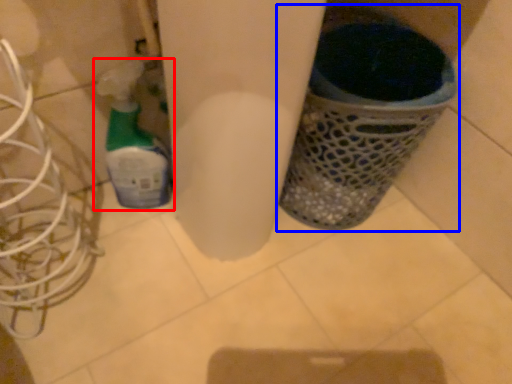
Question: Which object is further to the camera taking this photo, bottle (highlighted by a red box) or waste container (highlighted by a blue box)?

Choices:
 (A) bottle
 (B) waste container

Answer: (A)